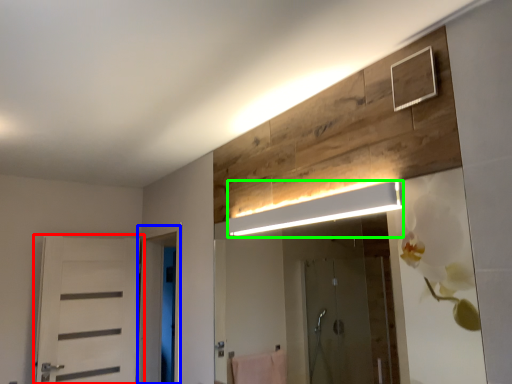
Question: Which object is the farthest from door (highlighted by a red box)? Choose among these: screen door (highlighted by a blue box) or light fixture (highlighted by a green box).

Choices:
 (A) screen door
 (B) light fixture

Answer: (B)